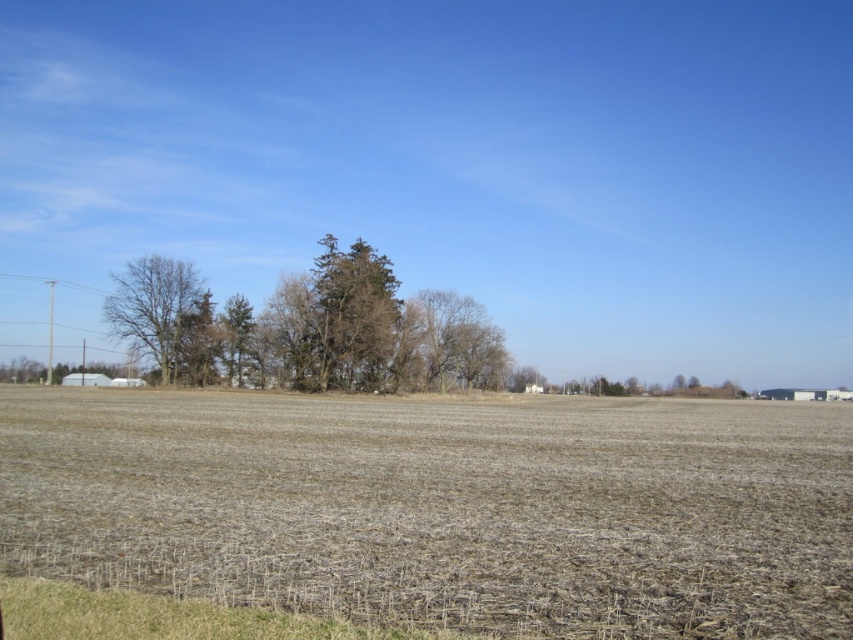
Question: Estimate the real-world distances between objects in this image. Which object is farther from the bare wood tree at center?

Choices:
 (A) brown dry grass at center
 (B) green leafy trees at center
 (C) bare branches at left
 (D) brown textured tree at center

Answer: (A)

Question: Is bare branches at left to the right of green textured tree at center from the viewer's perspective?

Choices:
 (A) yes
 (B) no

Answer: (B)

Question: Which point appears closest to the camera in this image?

Choices:
 (A) (x=404, y=356)
 (B) (x=120, y=273)
 (C) (x=312, y=356)

Answer: (C)

Question: Estimate the real-world distances between objects in this image. Which object is closer to the bare branches at left?

Choices:
 (A) brown dry grass at center
 (B) brown textured tree at center
 (C) green leafy trees at center
 (D) green textured tree at center

Answer: (D)

Question: Is brown textured tree at center wider than green textured tree at center?

Choices:
 (A) no
 (B) yes

Answer: (A)

Question: Is green leafy trees at center below bare wood tree at center?

Choices:
 (A) yes
 (B) no

Answer: (B)